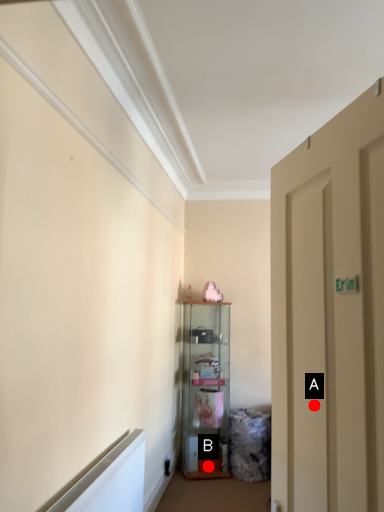
Question: Two points are circled on the image, labeled by A and B beside each circle. Which point is further to the camera?

Choices:
 (A) A is further
 (B) B is further

Answer: (B)